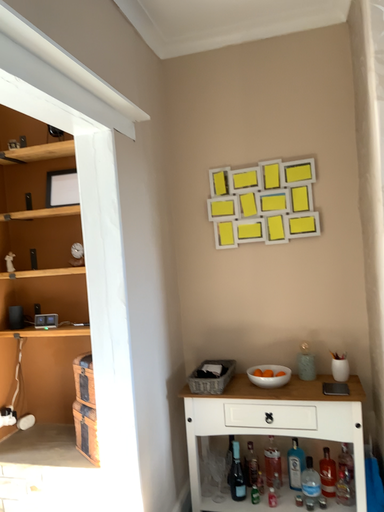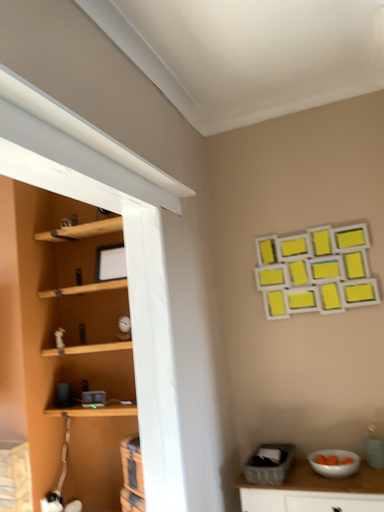
Question: Which way did the camera rotate in the video?

Choices:
 (A) rotated upward
 (B) rotated downward

Answer: (A)